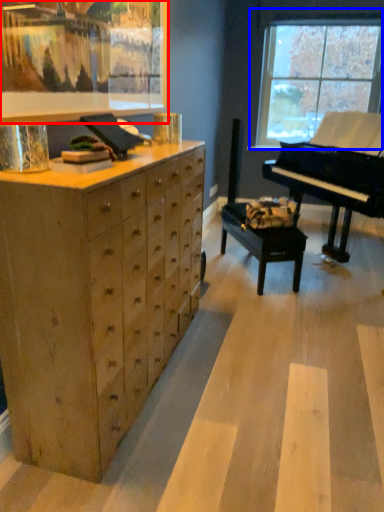
Question: Among these objects, which one is farthest to the camera, picture frame (highlighted by a red box) or window (highlighted by a blue box)?

Choices:
 (A) picture frame
 (B) window

Answer: (B)